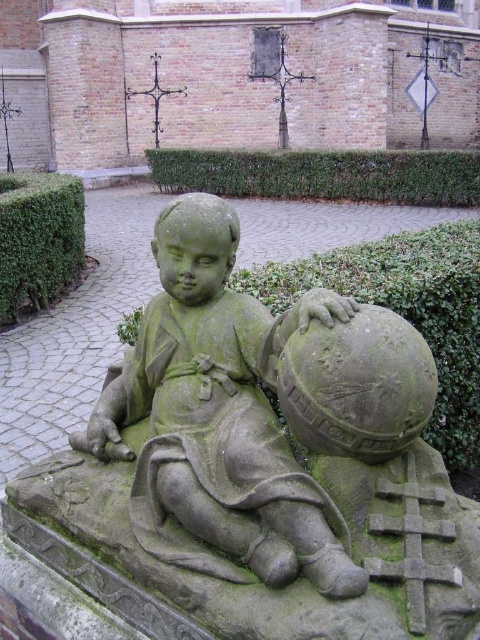
Question: Which point is farther to the camera?

Choices:
 (A) (292, 189)
 (B) (431, 417)

Answer: (A)

Question: Which is nearer to the green hedge at center?

Choices:
 (A) green hedge at upper left
 (B) green mossy hedge at center
 (C) green stone statue at center

Answer: (A)

Question: In this image, where is green mossy hedge at center located relative to green hedge at upper left?

Choices:
 (A) left
 (B) right

Answer: (B)

Question: Which point is closer to the camera taking this photo?

Choices:
 (A) (450, 292)
 (B) (468, 196)
 (C) (78, 268)
 (D) (249, 396)

Answer: (D)

Question: Can you confirm if green hedge at center is wider than green hedge at upper left?

Choices:
 (A) no
 (B) yes

Answer: (B)

Question: Does green stone statue at center have a lesser width compared to green hedge at upper left?

Choices:
 (A) no
 (B) yes

Answer: (B)